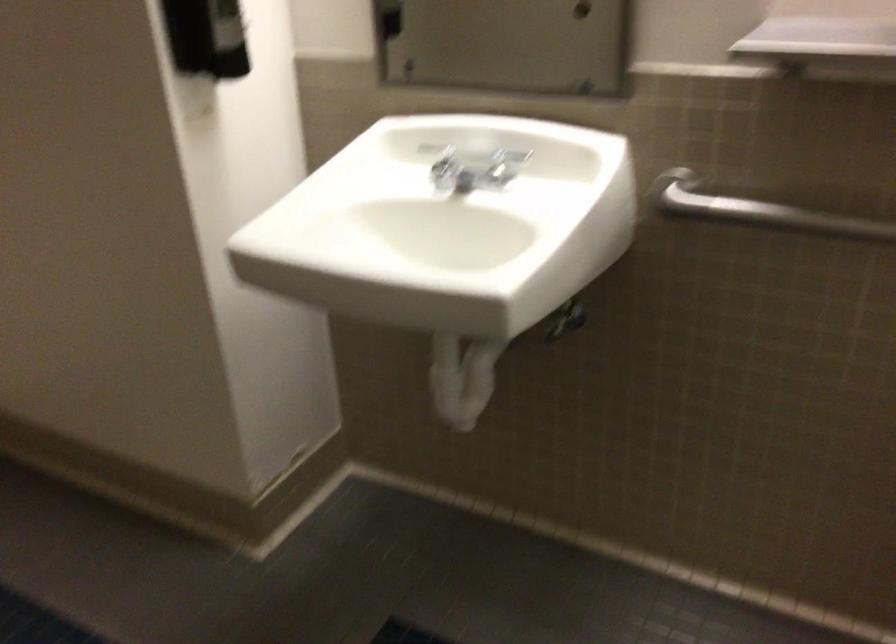
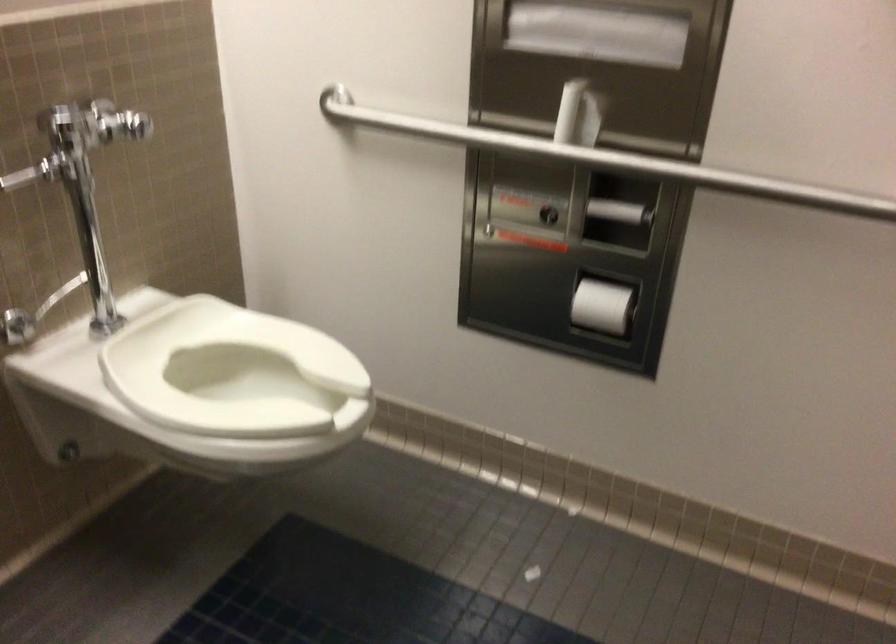
How did the camera likely rotate?

The camera rotated toward right-down.